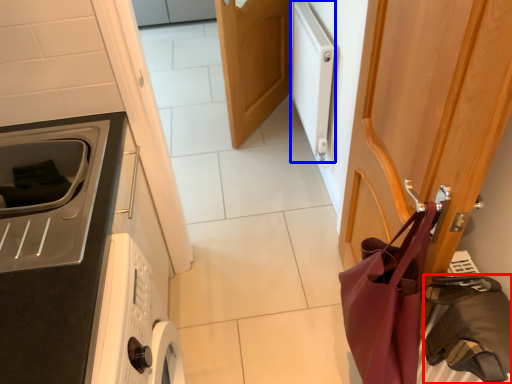
Question: Which object appears farthest to the camera in this image, bag (highlighted by a red box) or appliance (highlighted by a blue box)?

Choices:
 (A) bag
 (B) appliance

Answer: (B)